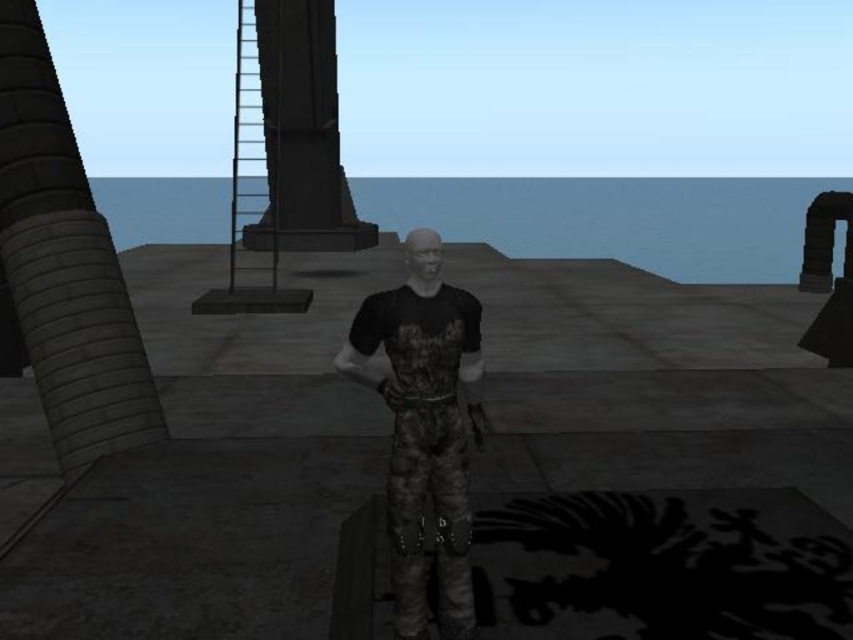
You are a delivery drone carrying a package that requires a 3 meter minimum distance to safely land. You need to land between the gray concrete pillar at left and the camouflage pants at center. Is there enough space for you to land safely?

The gray concrete pillar at left and camouflage pants at center are 2.91 meters apart. Since the required minimum distance is 3 meters, the space between them is insufficient for the drone to land safely.

You are a painter standing on the rooftop with a large canvas. You want to paint both the gray concrete pillar at left and the black stone pillar at upper center. Which pillar should you move closer to if you want to paint more details of the pillar that is wider?

The gray concrete pillar at left might be wider than the black stone pillar at upper center, so you should move closer to the gray concrete pillar at left to paint more details.

Based on the photo, you are standing on the rooftop and want to place a 10 foot long ladder between the camouflage pants at center and the black stone pillar at upper center. Is there enough space between them to place the ladder horizontally?

The distance between the camouflage pants at center and the black stone pillar at upper center is 35.58 feet, which is greater than the 10 foot length of the ladder, so there is enough space to place the ladder horizontally between them.